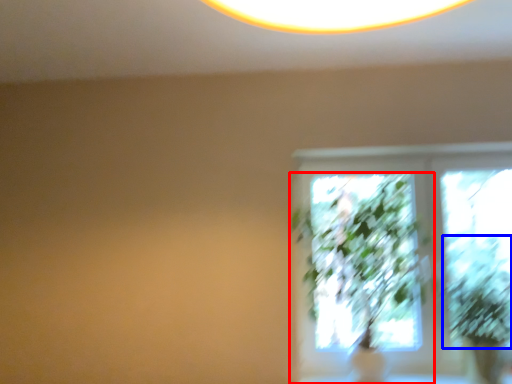
Question: Which point is further to the camera, houseplant (highlighted by a red box) or plant (highlighted by a blue box)?

Choices:
 (A) houseplant
 (B) plant

Answer: (B)